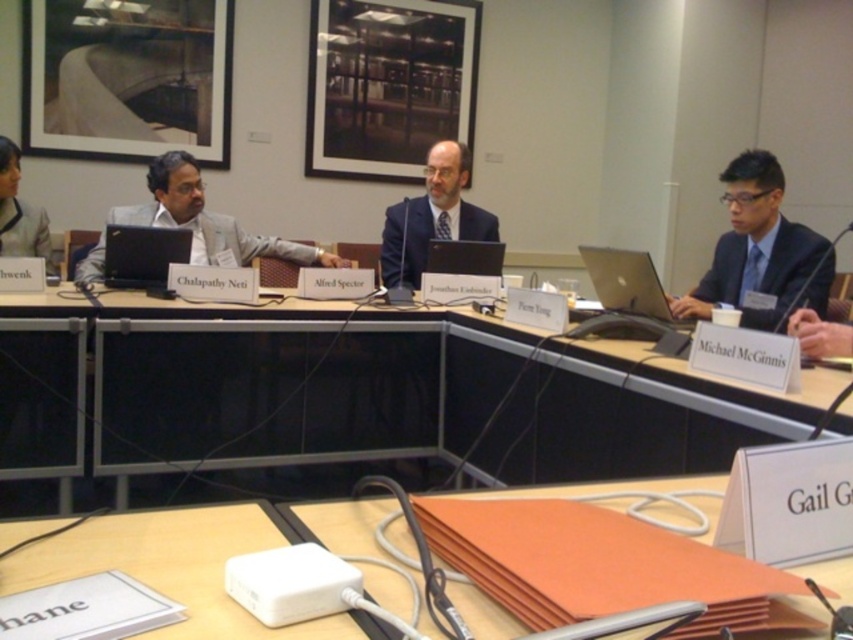
You are attending a meeting and need to present using the matte black laptop at center. The dark blue suit at right is blocking your access to the laptop. Can you move the suit to access the laptop?

The dark blue suit at right is positioned under the matte black laptop at center, so you can move the dark blue suit at right to access the matte black laptop at center since it is placed below it.

You are attending a conference and need to access your laptop quickly. You see two laptops on the table, the black glossy laptop at center and the matte black laptop at center. Which one is positioned higher and thus more easily accessible without moving anything?

The black glossy laptop at center is located above the matte black laptop at center, making it more easily accessible without moving anything.